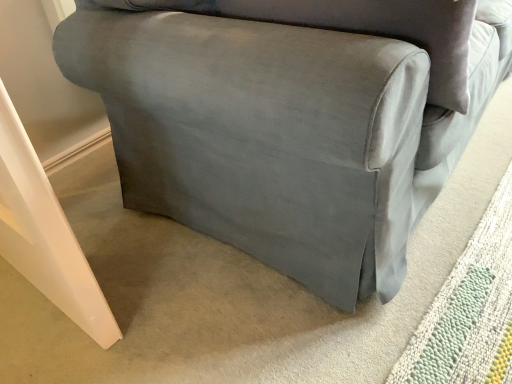
Describe the element at coordinates (291, 120) in the screenshot. This screenshot has height=384, width=512. I see `satin gray armchair at center` at that location.

I want to click on satin gray armchair at center, so click(291, 120).

Measure the distance between satin gray armchair at center and camera.

They are 24.58 inches apart.

Locate an element on the screen. The height and width of the screenshot is (384, 512). satin gray armchair at center is located at coordinates (291, 120).